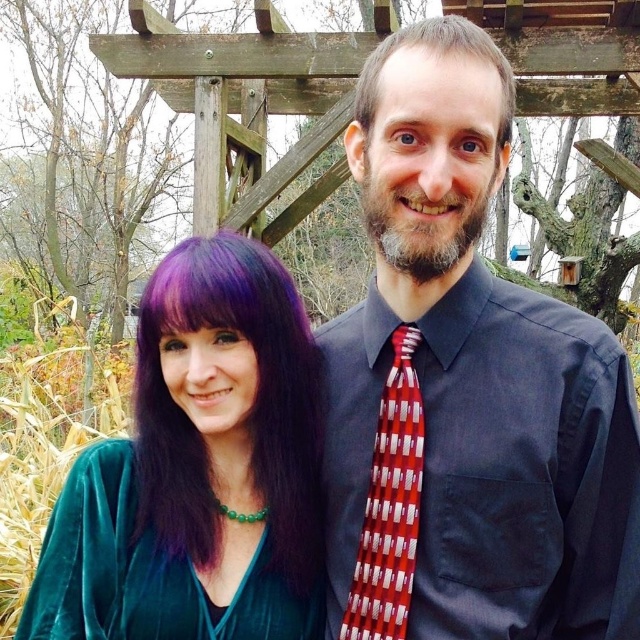
Does velvet green dress at center lie behind gray matte hair at upper center?

Yes, it is.

Is velvet green dress at center wider than gray matte hair at upper center?

Indeed, velvet green dress at center has a greater width compared to gray matte hair at upper center.

Between point (209, 468) and point (394, 38), which one is positioned behind?

Point (209, 468)

Find the location of a particular element. The width and height of the screenshot is (640, 640). velvet green dress at center is located at coordinates (198, 470).

You are a GUI agent. You are given a task and a screenshot of the screen. Output one action in this format:
    pyautogui.click(x=<x>, y=<y>)
    Task: Click on the matte black shirt at center
    This screenshot has height=640, width=640.
    Given the screenshot: What is the action you would take?
    pyautogui.click(x=465, y=388)

Can you confirm if matte black shirt at center is positioned to the left of velvet green dress at center?

Incorrect, matte black shirt at center is not on the left side of velvet green dress at center.

This screenshot has height=640, width=640. Find the location of `matte black shirt at center`. matte black shirt at center is located at coordinates (465, 388).

Can you confirm if matte black shirt at center is positioned to the right of velvet green dress at left?

Correct, you'll find matte black shirt at center to the right of velvet green dress at left.

Is point (352, 493) positioned after point (93, 476)?

No, it is not.

Where is `matte black shirt at center`? matte black shirt at center is located at coordinates (465, 388).